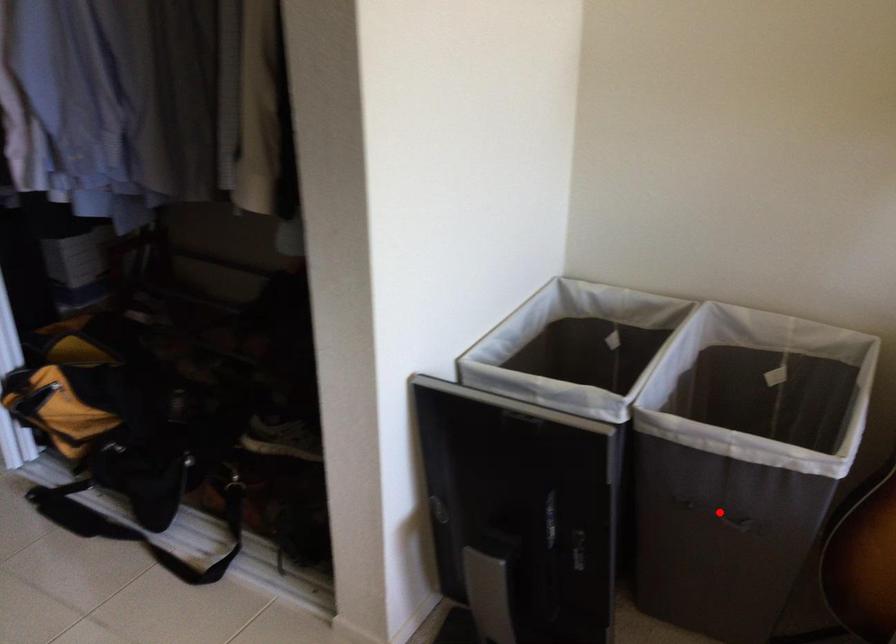
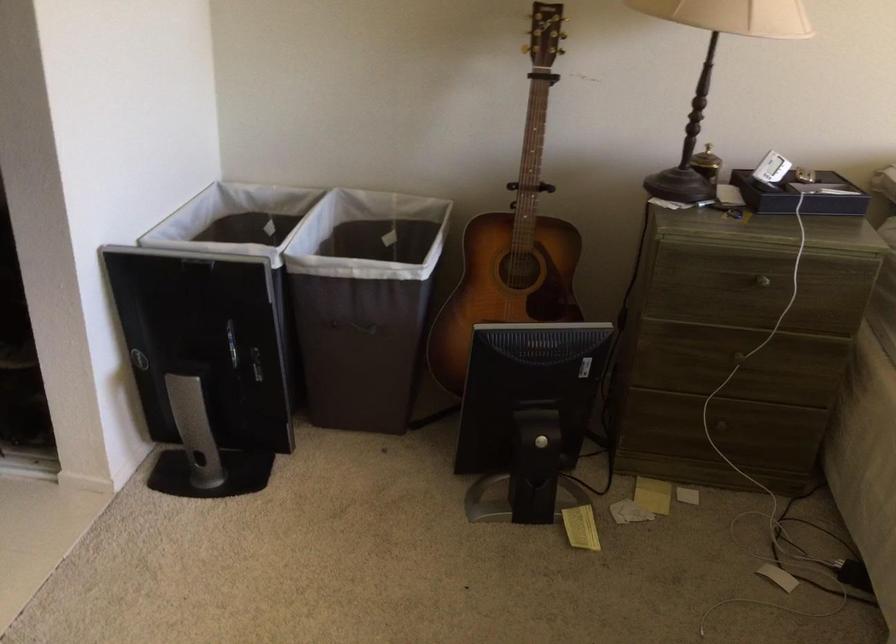
Question: I am providing you with two images of the same scene from different viewpoints. A red point is shown in image1. For the corresponding object point in image2, is it positioned nearer or farther from the camera?

Choices:
 (A) Nearer
 (B) Farther

Answer: (B)